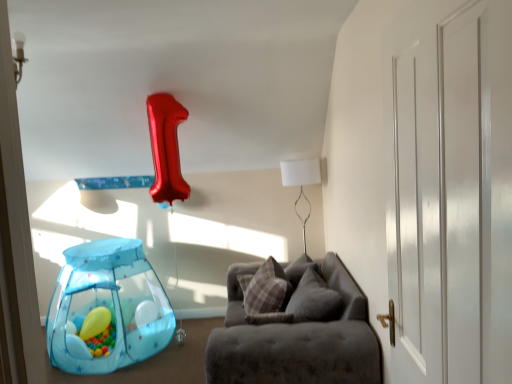
Question: Is plaid fabric pillow at center not close to matte yellow balloon at lower left, which appears as the first balloon when viewed from the left?

Choices:
 (A) yes
 (B) no

Answer: (A)

Question: From a real-world perspective, is plaid fabric pillow at center positioned under matte yellow balloon at lower left, which appears as the first balloon when viewed from the left, based on gravity?

Choices:
 (A) yes
 (B) no

Answer: (B)

Question: Is plaid fabric pillow at center taller than matte yellow balloon at lower left, which appears as the first balloon when viewed from the left?

Choices:
 (A) no
 (B) yes

Answer: (B)

Question: Does plaid fabric pillow at center have a larger size compared to matte yellow balloon at lower left, which appears as the first balloon when viewed from the left?

Choices:
 (A) no
 (B) yes

Answer: (B)

Question: Is plaid fabric pillow at center not within matte yellow balloon at lower left, which appears as the first balloon when viewed from the left?

Choices:
 (A) yes
 (B) no

Answer: (A)

Question: In the image, is velvet grey couch at center positioned in front of or behind white glossy door at right?

Choices:
 (A) front
 (B) behind

Answer: (B)

Question: In the image, is velvet grey couch at center on the left side or the right side of white glossy door at right?

Choices:
 (A) left
 (B) right

Answer: (A)

Question: Is point (236, 317) positioned closer to the camera than point (455, 170)?

Choices:
 (A) farther
 (B) closer

Answer: (A)

Question: From the image's perspective, is velvet grey couch at center above or below white glossy door at right?

Choices:
 (A) below
 (B) above

Answer: (A)

Question: From a real-world perspective, is plaid fabric pillow at center physically located above or below translucent blue mesh tent at lower left, the first balloon in the right-to-left sequence?

Choices:
 (A) above
 (B) below

Answer: (A)

Question: Is plaid fabric pillow at center situated inside translucent blue mesh tent at lower left, the first balloon in the right-to-left sequence, or outside?

Choices:
 (A) inside
 (B) outside

Answer: (B)

Question: From the image's perspective, is plaid fabric pillow at center located above or below translucent blue mesh tent at lower left, the second balloon viewed from the left?

Choices:
 (A) above
 (B) below

Answer: (A)

Question: Is point (274, 261) closer or farther from the camera than point (88, 299)?

Choices:
 (A) farther
 (B) closer

Answer: (B)

Question: In the image, is white glossy door at right on the left side or the right side of translucent blue mesh tent at lower left, the second balloon viewed from the left?

Choices:
 (A) left
 (B) right

Answer: (B)

Question: Is point (502, 253) positioned closer to the camera than point (62, 332)?

Choices:
 (A) farther
 (B) closer

Answer: (B)